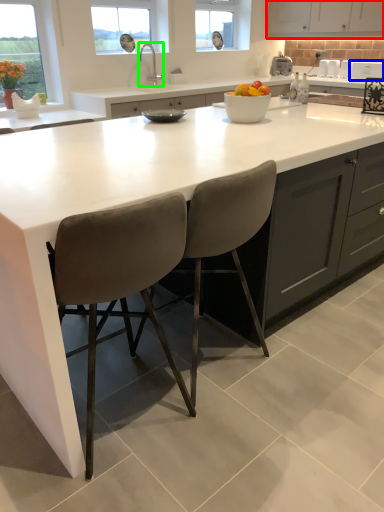
Question: Estimate the real-world distances between objects in this image. Which object is farther from cabinetry (highlighted by a red box), appliance (highlighted by a blue box) or tap (highlighted by a green box)?

Choices:
 (A) appliance
 (B) tap

Answer: (B)